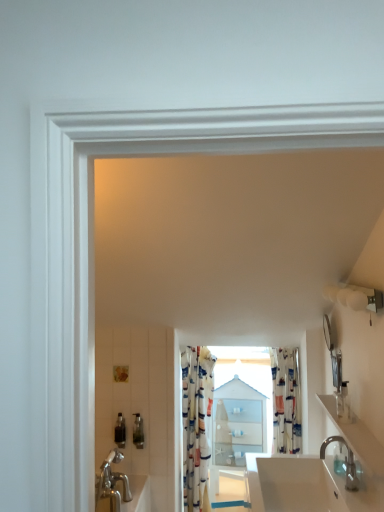
Question: Considering the positions of point (340, 440) and point (125, 425), is point (340, 440) closer or farther from the camera than point (125, 425)?

Choices:
 (A) closer
 (B) farther

Answer: (A)

Question: From the image's perspective, relative to translucent plastic soap dispenser at lower left, positioned as the 1th toiletry in left-to-right order, is silver metallic faucet at lower right above or below?

Choices:
 (A) below
 (B) above

Answer: (B)

Question: Which object is the farthest from the white glossy sink at lower center?

Choices:
 (A) translucent plastic soap dispenser at lower left, positioned as the 1th toiletry in left-to-right order
 (B) clear plastic soap dispenser at right, positioned as the 2th toiletry in bottom-to-top order
 (C) silver metallic faucet at lower right
 (D) floral fabric shower curtain at center, arranged as the second shower curtain when viewed from the right
 (E) white glossy cabinet at center

Answer: (A)

Question: Which object is positioned closest to the printed fabric shower curtain at center, the 2th shower curtain in the left-to-right sequence?

Choices:
 (A) silver metallic faucet at lower right
 (B) translucent plastic soap dispenser at lower left, which is counted as the first toiletry, starting from the bottom
 (C) glossy metallic mirror at upper right
 (D) white glossy countertop at lower right
 (E) clear plastic soap dispenser at right, positioned as the 2th toiletry in bottom-to-top order

Answer: (A)